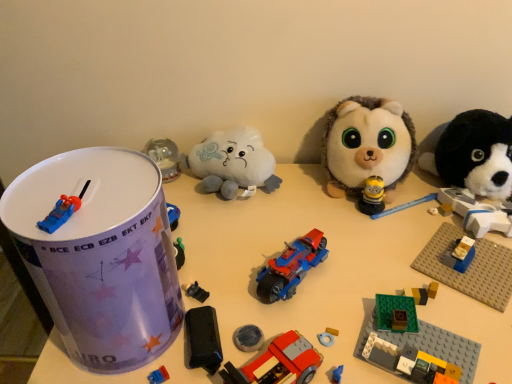
Identify the location of free space behind black plastic toy car at center, placed as the fourth toy when sorted from left to right. (225, 230).